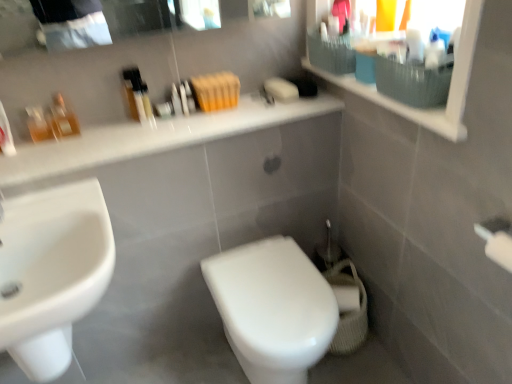
Find the location of a particular element. Image resolution: width=512 pixels, height=384 pixels. spots to the right of translucent glass perfume bottles at upper left, arranged as the 2th toiletry when viewed from the right is located at coordinates (111, 124).